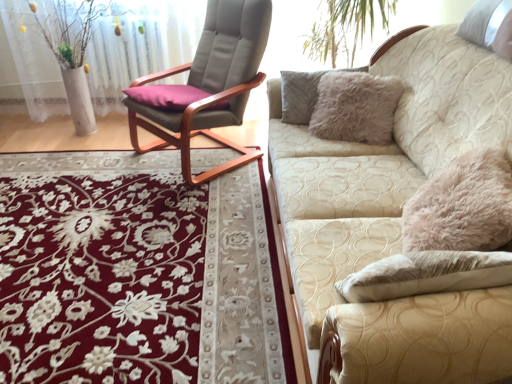
The width and height of the screenshot is (512, 384). Find the location of `free spot above floral carpet at center (from a real-world perspective)`. free spot above floral carpet at center (from a real-world perspective) is located at coordinates (80, 206).